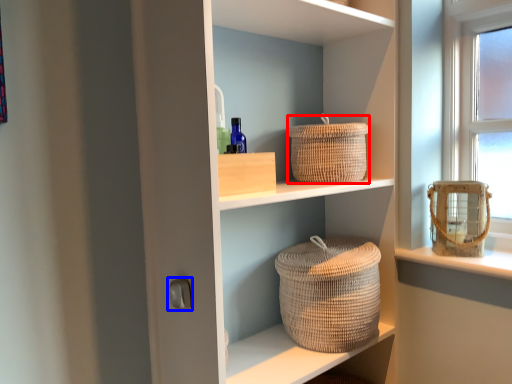
Question: Which object appears farthest to the camera in this image, basket (highlighted by a red box) or door handle (highlighted by a blue box)?

Choices:
 (A) basket
 (B) door handle

Answer: (A)